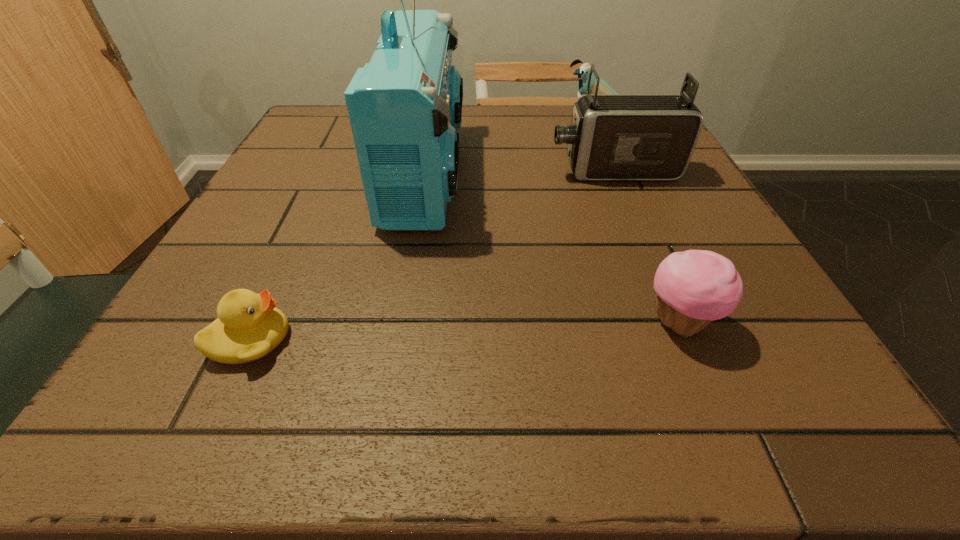
Where is `object that stands as the closest to the camcorder`? The width and height of the screenshot is (960, 540). object that stands as the closest to the camcorder is located at coordinates (583, 72).

The image size is (960, 540). Identify the location of the second closest object to the leftmost object. (695, 287).

What are the coordinates of `free location that satisfies the following two spatial constraints: 1. at the lens of the cupcake; 2. on the right side of the camcorder` in the screenshot? It's located at (677, 322).

You are a GUI agent. You are given a task and a screenshot of the screen. Output one action in this format:
    pyautogui.click(x=<x>, y=<y>)
    Task: Click on the free space that satisfies the following two spatial constraints: 1. at the lens of the cupcake; 2. on the left side of the fourth shortest object
    The width and height of the screenshot is (960, 540).
    Given the screenshot: What is the action you would take?
    pyautogui.click(x=677, y=322)